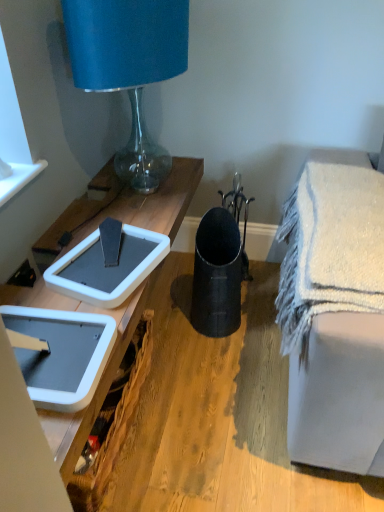
Question: Does white textured bath towel at lower right lie behind matte black vase at center?

Choices:
 (A) no
 (B) yes

Answer: (A)

Question: Does white textured bath towel at lower right have a smaller size compared to matte black vase at center?

Choices:
 (A) no
 (B) yes

Answer: (A)

Question: From the image's perspective, would you say white textured bath towel at lower right is positioned over matte black vase at center?

Choices:
 (A) no
 (B) yes

Answer: (B)

Question: Is white textured bath towel at lower right in contact with matte black vase at center?

Choices:
 (A) yes
 (B) no

Answer: (B)

Question: Does white textured bath towel at lower right have a greater height compared to matte black vase at center?

Choices:
 (A) no
 (B) yes

Answer: (B)

Question: Considering the relative sizes of white textured bath towel at lower right and matte black vase at center in the image provided, is white textured bath towel at lower right thinner than matte black vase at center?

Choices:
 (A) no
 (B) yes

Answer: (B)

Question: Is white plastic picnic basket at lower left directly adjacent to matte black vase at center?

Choices:
 (A) no
 (B) yes

Answer: (A)

Question: Is white plastic picnic basket at lower left shorter than matte black vase at center?

Choices:
 (A) no
 (B) yes

Answer: (A)

Question: Does white plastic picnic basket at lower left have a larger size compared to matte black vase at center?

Choices:
 (A) yes
 (B) no

Answer: (B)

Question: Considering the relative positions of white plastic picnic basket at lower left and matte black vase at center in the image provided, is white plastic picnic basket at lower left behind matte black vase at center?

Choices:
 (A) yes
 (B) no

Answer: (B)

Question: Is white plastic picnic basket at lower left positioned beyond the bounds of matte black vase at center?

Choices:
 (A) no
 (B) yes

Answer: (B)

Question: Can matte black vase at center be found inside white plastic picnic basket at lower left?

Choices:
 (A) yes
 (B) no

Answer: (B)

Question: Is white textured bath towel at lower right beside blue fabric lampshade at upper left?

Choices:
 (A) no
 (B) yes

Answer: (A)